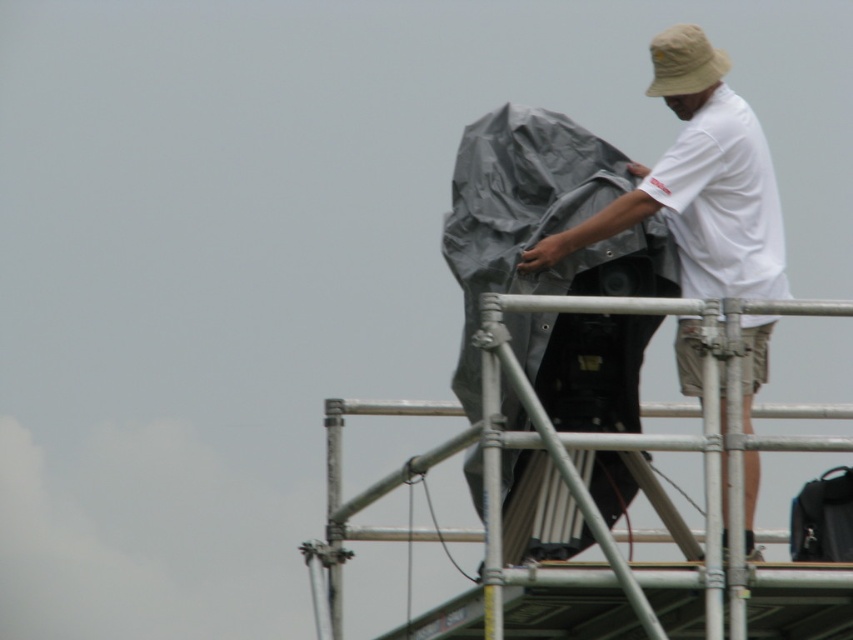
Is silver metallic scaffolding at upper center behind white cotton shirt at upper right?

No, silver metallic scaffolding at upper center is closer to the viewer.

The height and width of the screenshot is (640, 853). In order to click on silver metallic scaffolding at upper center in this screenshot , I will do `click(607, 449)`.

Between silver metallic scaffolding at upper center and black fabric bag at upper right, which one has more height?

With more height is silver metallic scaffolding at upper center.

Does silver metallic scaffolding at upper center have a lesser height compared to black fabric bag at upper right?

No, silver metallic scaffolding at upper center is not shorter than black fabric bag at upper right.

The height and width of the screenshot is (640, 853). What do you see at coordinates (607, 449) in the screenshot? I see `silver metallic scaffolding at upper center` at bounding box center [607, 449].

Locate an element on the screen. This screenshot has width=853, height=640. silver metallic scaffolding at upper center is located at coordinates (607, 449).

Can you confirm if white cotton shirt at upper right is wider than black fabric bag at upper right?

Indeed, white cotton shirt at upper right has a greater width compared to black fabric bag at upper right.

Does white cotton shirt at upper right appear on the left side of black fabric bag at upper right?

Correct, you'll find white cotton shirt at upper right to the left of black fabric bag at upper right.

Identify the location of white cotton shirt at upper right. Image resolution: width=853 pixels, height=640 pixels. (698, 182).